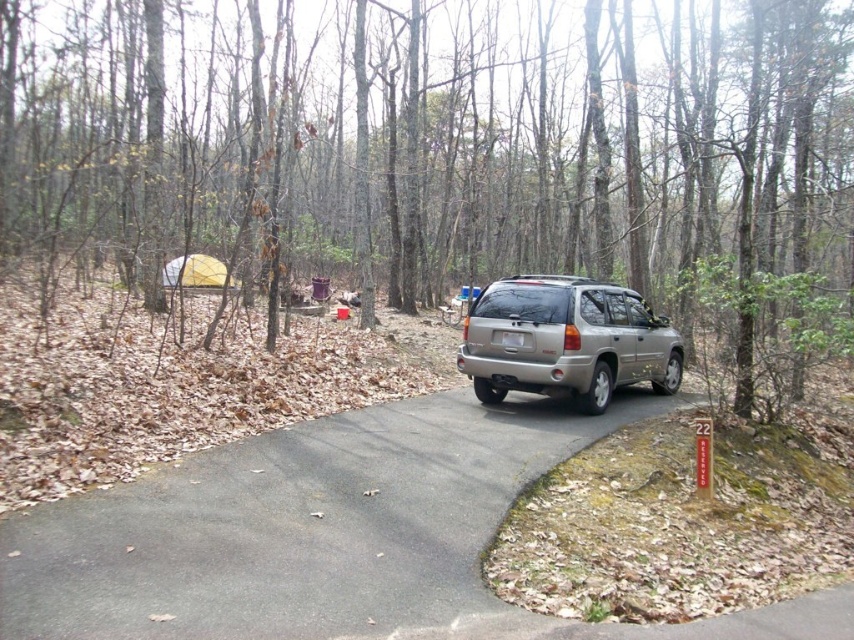
You are standing at the point with coordinates point [437,481] and want to walk towards the point [86,12]. Which direction should you move in to reach it?

Since point [86,12] is closer to the camera than point [437,481], you should move towards the direction of the camera to reach it.

Looking at this image, you are planning to take a photo of the silver metallic suv at center from the brown bark tree at center. Will the tree block the view of the SUV completely?

The brown bark tree at center is much taller than the silver metallic suv at center, so it might block the view depending on the angle, but since they are both at the center, positioning could allow partial visibility.